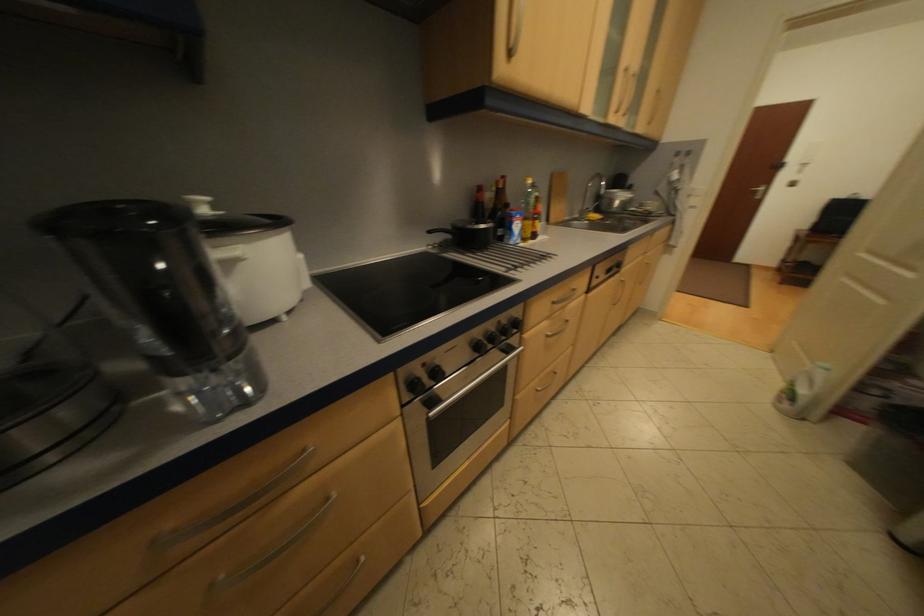
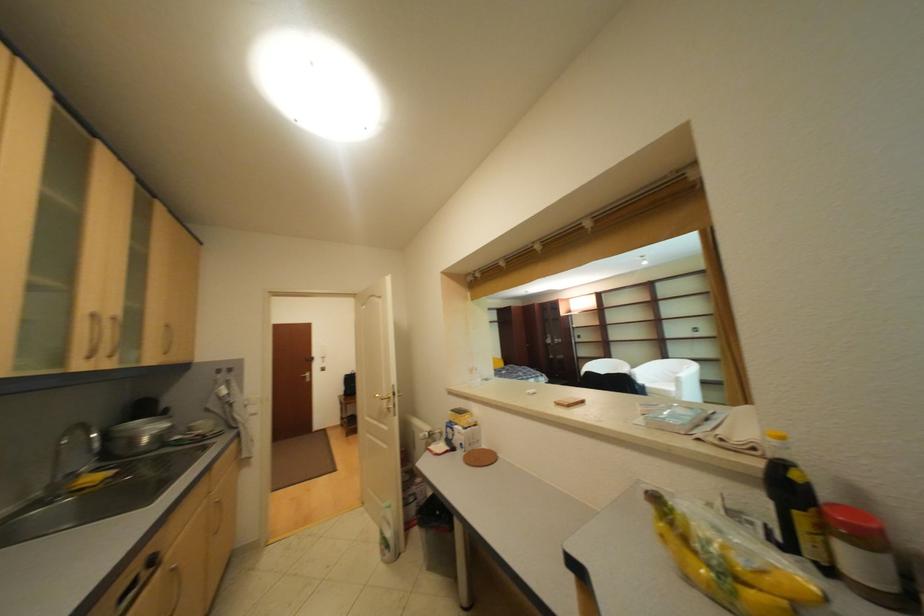
Locate, in the second image, the point that corresponds to (x=635, y=280) in the first image.

(186, 567)